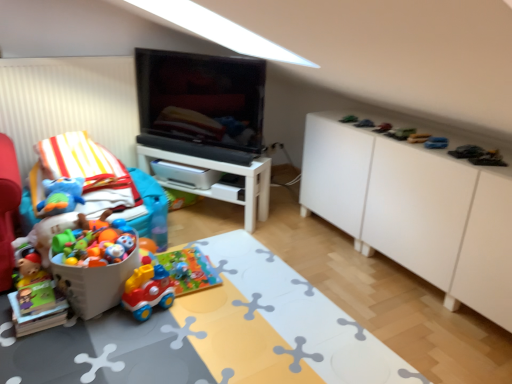
I want to click on free space above wooden toy train at lower left, acting as the tenth toy starting from the right (from a real-world perspective), so click(x=37, y=282).